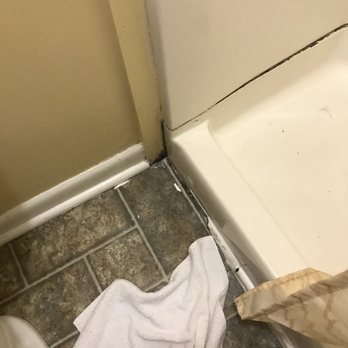
What are the coordinates of `white painted baseboard` in the screenshot? It's located at (114, 168).